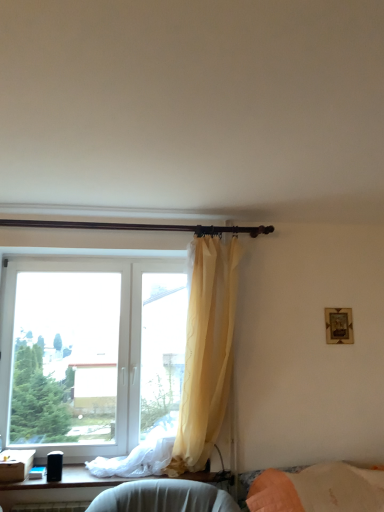
Locate an element on the screen. The width and height of the screenshot is (384, 512). translucent yellow curtain at upper center is located at coordinates (194, 372).

Describe the element at coordinates (194, 372) in the screenshot. I see `translucent yellow curtain at upper center` at that location.

What is the approximate height of dark brown wooden curtain rod at upper center?

It is 4.53 inches.

In order to face white plastic window at left, should I rotate leftwards or rightwards?

To align with it, rotate left about 13.030°.

The width and height of the screenshot is (384, 512). In order to click on black plastic speaker at lower left in this screenshot , I will do (56, 490).

The height and width of the screenshot is (512, 384). I want to click on translucent yellow curtain at upper center, so click(x=194, y=372).

Does white plastic window at left have a greater height compared to gold metallic picture frame at upper right?

Yes, white plastic window at left is taller than gold metallic picture frame at upper right.

Considering the relative sizes of white plastic window at left and gold metallic picture frame at upper right in the image provided, is white plastic window at left bigger than gold metallic picture frame at upper right?

Correct, white plastic window at left is larger in size than gold metallic picture frame at upper right.

From the picture: Considering the relative sizes of white plastic window at left and gold metallic picture frame at upper right in the image provided, is white plastic window at left thinner than gold metallic picture frame at upper right?

In fact, white plastic window at left might be wider than gold metallic picture frame at upper right.

From the image's perspective, which object appears higher, white plastic window at left or gold metallic picture frame at upper right?

From the image's view, gold metallic picture frame at upper right is above.

Is gold metallic picture frame at upper right aimed at translucent yellow curtain at upper center?

No, gold metallic picture frame at upper right is not oriented towards translucent yellow curtain at upper center.

Would you consider gold metallic picture frame at upper right to be distant from translucent yellow curtain at upper center?

Yes, gold metallic picture frame at upper right is far from translucent yellow curtain at upper center.

Which object is wider, gold metallic picture frame at upper right or translucent yellow curtain at upper center?

With larger width is translucent yellow curtain at upper center.

How far apart are gold metallic picture frame at upper right and translucent yellow curtain at upper center?

gold metallic picture frame at upper right is 3.32 feet away from translucent yellow curtain at upper center.

Do you think black plastic speaker at lower left is within gold metallic picture frame at upper right, or outside of it?

The correct answer is: outside.

Does black plastic speaker at lower left have a greater width compared to gold metallic picture frame at upper right?

Yes.

Where is `picture frame above the black plastic speaker at lower left (from a real-world perspective)`? The width and height of the screenshot is (384, 512). picture frame above the black plastic speaker at lower left (from a real-world perspective) is located at coordinates (339, 326).

How different are the orientations of black plastic speaker at lower left and gold metallic picture frame at upper right in degrees?

The facing directions of black plastic speaker at lower left and gold metallic picture frame at upper right are 1 degrees apart.

Who is taller, black plastic speaker at lower left or translucent yellow curtain at upper center?

translucent yellow curtain at upper center.

Considering the sizes of objects black plastic speaker at lower left and translucent yellow curtain at upper center in the image provided, who is smaller, black plastic speaker at lower left or translucent yellow curtain at upper center?

With smaller size is black plastic speaker at lower left.

Is black plastic speaker at lower left to the left or to the right of translucent yellow curtain at upper center in the image?

Clearly, black plastic speaker at lower left is on the left of translucent yellow curtain at upper center in the image.

Is translucent yellow curtain at upper center smaller than black plastic speaker at lower left?

No, translucent yellow curtain at upper center is not smaller than black plastic speaker at lower left.

Is translucent yellow curtain at upper center in front of black plastic speaker at lower left?

Yes, it is.

Considering the sizes of translucent yellow curtain at upper center and black plastic speaker at lower left in the image, is translucent yellow curtain at upper center wider or thinner than black plastic speaker at lower left?

Considering their sizes, translucent yellow curtain at upper center looks broader than black plastic speaker at lower left.

Find the location of a particular element. furniture located on the left of translucent yellow curtain at upper center is located at coordinates (56, 490).

Is dark brown wooden curtain rod at upper center not inside gold metallic picture frame at upper right?

Absolutely, dark brown wooden curtain rod at upper center is external to gold metallic picture frame at upper right.

Is dark brown wooden curtain rod at upper center next to gold metallic picture frame at upper right?

dark brown wooden curtain rod at upper center and gold metallic picture frame at upper right are not in contact.

Between point (1, 224) and point (341, 309), which one is positioned in front?

Point (1, 224)

From a real-world perspective, relative to gold metallic picture frame at upper right, is dark brown wooden curtain rod at upper center vertically above or below?

dark brown wooden curtain rod at upper center is situated higher than gold metallic picture frame at upper right in the real world.

From the image's perspective, which is below, white plastic window at left or black plastic speaker at lower left?

black plastic speaker at lower left.

How different are the orientations of white plastic window at left and black plastic speaker at lower left in degrees?

The angular difference between white plastic window at left and black plastic speaker at lower left is 0.733 degrees.

Which object is closer to the camera taking this photo, white plastic window at left or black plastic speaker at lower left?

black plastic speaker at lower left is closer to the camera.

Is white plastic window at left inside the boundaries of black plastic speaker at lower left, or outside?

white plastic window at left exists outside the volume of black plastic speaker at lower left.

The width and height of the screenshot is (384, 512). I want to click on picture frame that is on the right side of white plastic window at left, so click(x=339, y=326).

What are the coordinates of `curtain on the left of gold metallic picture frame at upper right` in the screenshot? It's located at tap(194, 372).

Based on their spatial positions, is black plastic speaker at lower left or white plastic window at left closer to gold metallic picture frame at upper right?

white plastic window at left.

Which object lies further to the anchor point black plastic speaker at lower left, gold metallic picture frame at upper right or translucent yellow curtain at upper center?

Based on the image, gold metallic picture frame at upper right appears to be further to black plastic speaker at lower left.

Considering their positions, is white plastic window at left positioned further to translucent yellow curtain at upper center than dark brown wooden curtain rod at upper center?

dark brown wooden curtain rod at upper center lies further to translucent yellow curtain at upper center than the other object.

Estimate the real-world distances between objects in this image. Which object is further from black plastic speaker at lower left, dark brown wooden curtain rod at upper center or gold metallic picture frame at upper right?

gold metallic picture frame at upper right.

Based on their spatial positions, is black plastic speaker at lower left or translucent yellow curtain at upper center further from dark brown wooden curtain rod at upper center?

black plastic speaker at lower left is further to dark brown wooden curtain rod at upper center.

Looking at the image, which one is located further to white plastic window at left, black plastic speaker at lower left or translucent yellow curtain at upper center?

black plastic speaker at lower left.

Looking at the image, which one is located further to black plastic speaker at lower left, dark brown wooden curtain rod at upper center or translucent yellow curtain at upper center?

dark brown wooden curtain rod at upper center lies further to black plastic speaker at lower left than the other object.

Considering their positions, is black plastic speaker at lower left positioned closer to white plastic window at left than dark brown wooden curtain rod at upper center?

black plastic speaker at lower left lies closer to white plastic window at left than the other object.

Find the location of a particular element. This screenshot has height=512, width=384. curtain between white plastic window at left and gold metallic picture frame at upper right in the horizontal direction is located at coordinates point(194,372).

Where is `window between translucent yellow curtain at upper center and black plastic speaker at lower left in the vertical direction`? window between translucent yellow curtain at upper center and black plastic speaker at lower left in the vertical direction is located at coordinates (90, 354).

This screenshot has width=384, height=512. Identify the location of beam between white plastic window at left and gold metallic picture frame at upper right in the horizontal direction. (139, 227).

This screenshot has height=512, width=384. I want to click on curtain between dark brown wooden curtain rod at upper center and white plastic window at left vertically, so click(194, 372).